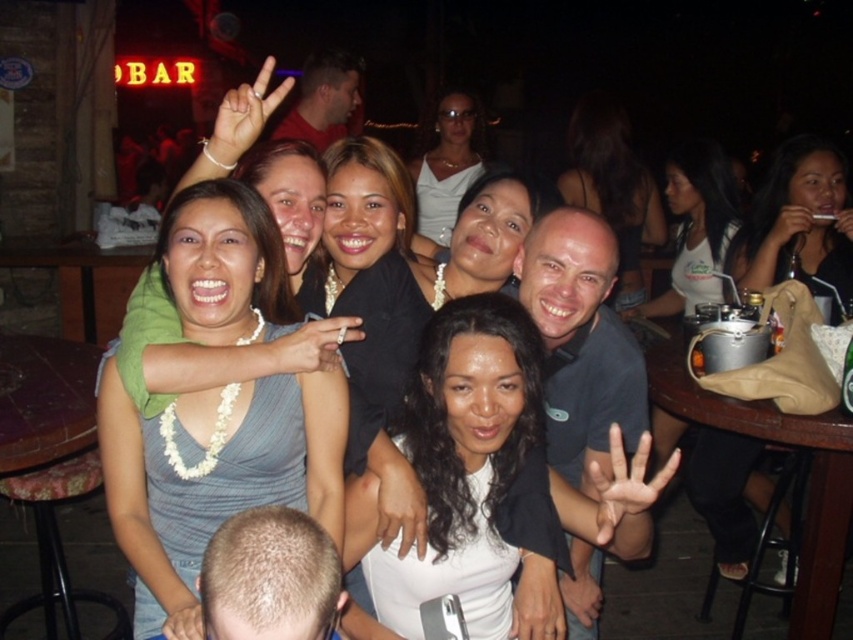
Is point (254, 230) farther from camera compared to point (300, 131)?

No, (254, 230) is closer to viewer.

Find the location of a particular element. white beaded necklace at center is located at coordinates (213, 476).

Is dark brown hair at upper right wider than white satin dress at center?

Indeed, dark brown hair at upper right has a greater width compared to white satin dress at center.

Describe the element at coordinates (798, 224) in the screenshot. I see `dark brown hair at upper right` at that location.

Is point (709, 467) less distant than point (426, 193)?

That is True.

This screenshot has height=640, width=853. Find the location of `dark brown hair at upper right`. dark brown hair at upper right is located at coordinates (798, 224).

Is white matte shirt at center to the right of white satin dress at center from the viewer's perspective?

Indeed, white matte shirt at center is positioned on the right side of white satin dress at center.

Image resolution: width=853 pixels, height=640 pixels. What do you see at coordinates (469, 461) in the screenshot?
I see `white matte shirt at center` at bounding box center [469, 461].

Find the location of a particular element. The width and height of the screenshot is (853, 640). white matte shirt at center is located at coordinates (469, 461).